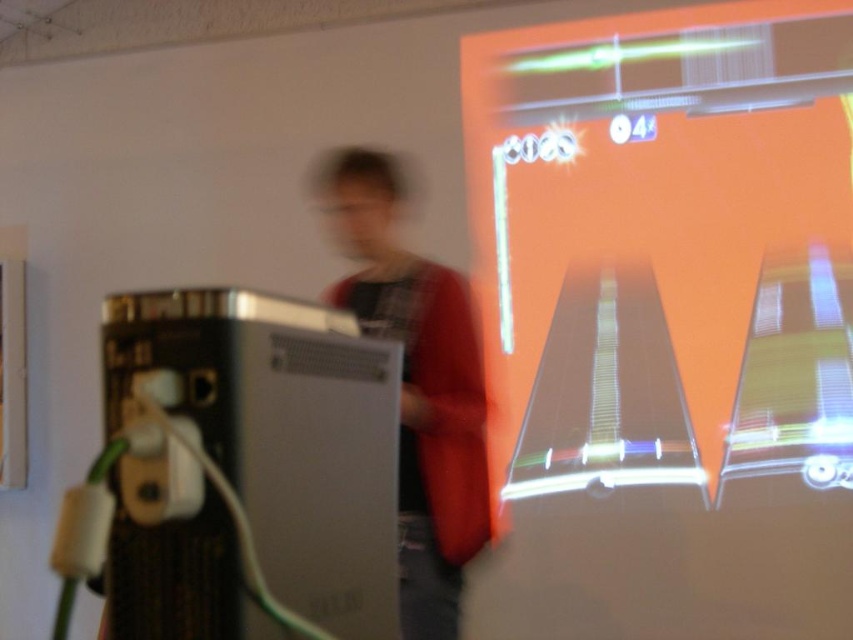
Which of these two, orange glossy projection screen at upper right or metallic silver console at left, stands shorter?

Standing shorter between the two is metallic silver console at left.

Between orange glossy projection screen at upper right and metallic silver console at left, which one appears on the left side from the viewer's perspective?

metallic silver console at left

At what (x,y) coordinates should I click in order to perform the action: click on orange glossy projection screen at upper right. Please return your answer as a coordinate pair (x, y). The width and height of the screenshot is (853, 640). Looking at the image, I should click on (666, 248).

Who is more forward, (323,358) or (163,486)?

Point (163,486) is more forward.

Is metallic silver console at left taller than white plastic plug at lower left?

Correct, metallic silver console at left is much taller as white plastic plug at lower left.

The height and width of the screenshot is (640, 853). In order to click on metallic silver console at left in this screenshot , I will do `click(280, 433)`.

Does red sweater at center have a lesser width compared to white plastic plug at lower left?

No, red sweater at center is not thinner than white plastic plug at lower left.

Is red sweater at center to the right of white plastic plug at lower left from the viewer's perspective?

Yes, red sweater at center is to the right of white plastic plug at lower left.

Who is more forward, (387,195) or (154,474)?

Point (154,474) is more forward.

The width and height of the screenshot is (853, 640). I want to click on red sweater at center, so click(416, 387).